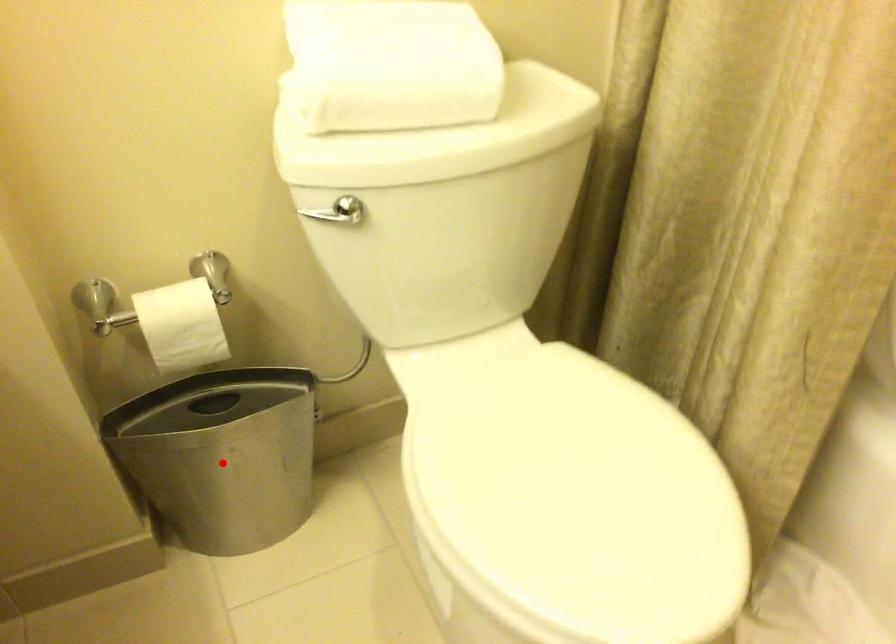
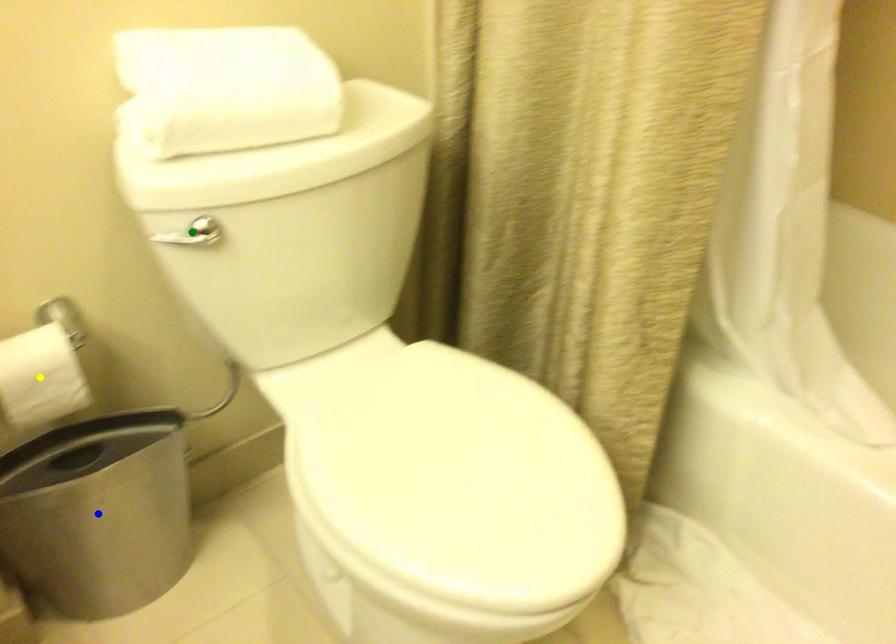
Question: I am providing you with two images of the same scene from different viewpoints. A red point is marked on the first image. You are given multiple points on the second image. Which mark in image 2 goes with the point in image 1?

Choices:
 (A) green point
 (B) blue point
 (C) yellow point

Answer: (B)